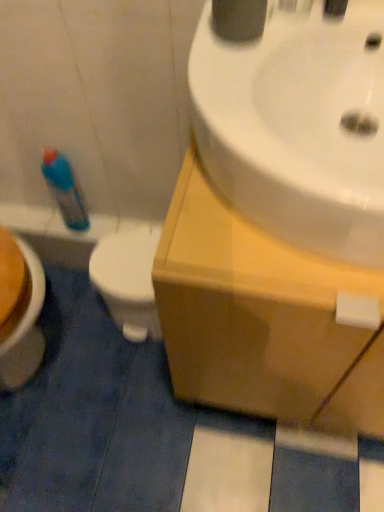
Identify the location of vacant space positioned to the left of white glossy toilet at lower left. (70, 315).